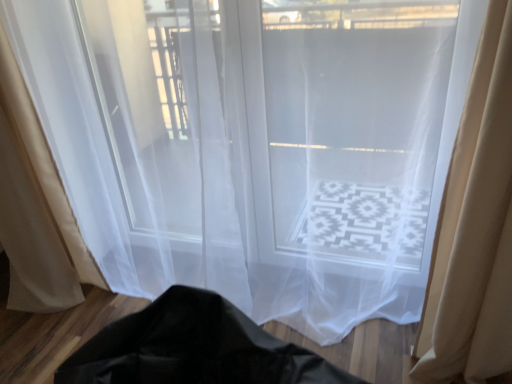
You are a GUI agent. You are given a task and a screenshot of the screen. Output one action in this format:
    pyautogui.click(x=<x>, y=<y>)
    Task: Click on the beige sheer curtain at right, the 2th curtain viewed from the left
    The height and width of the screenshot is (384, 512).
    Given the screenshot: What is the action you would take?
    pyautogui.click(x=475, y=227)

The width and height of the screenshot is (512, 384). What do you see at coordinates (475, 227) in the screenshot? I see `beige sheer curtain at right, the 2th curtain viewed from the left` at bounding box center [475, 227].

What do you see at coordinates (36, 207) in the screenshot? I see `beige sheer curtain at left, positioned as the second curtain in right-to-left order` at bounding box center [36, 207].

This screenshot has height=384, width=512. I want to click on beige sheer curtain at left, positioned as the second curtain in right-to-left order, so click(36, 207).

Locate an element on the screen. The image size is (512, 384). beige sheer curtain at right, the 2th curtain viewed from the left is located at coordinates (475, 227).

Which is more to the right, beige sheer curtain at left, the first curtain positioned from the left, or beige sheer curtain at right, which is counted as the first curtain, starting from the right?

beige sheer curtain at right, which is counted as the first curtain, starting from the right, is more to the right.

Is beige sheer curtain at left, the first curtain positioned from the left, in front of or behind beige sheer curtain at right, the 2th curtain viewed from the left, in the image?

beige sheer curtain at left, the first curtain positioned from the left, is behind beige sheer curtain at right, the 2th curtain viewed from the left.

Consider the image. Which is nearer, (32, 164) or (448, 237)?

Point (32, 164).

From the image's perspective, is beige sheer curtain at left, the first curtain positioned from the left, on beige sheer curtain at right, the 2th curtain viewed from the left?

Indeed, from the image's perspective, beige sheer curtain at left, the first curtain positioned from the left, is shown above beige sheer curtain at right, the 2th curtain viewed from the left.

From a real-world perspective, who is located lower, beige sheer curtain at left, positioned as the second curtain in right-to-left order, or beige sheer curtain at right, the 2th curtain viewed from the left?

beige sheer curtain at right, the 2th curtain viewed from the left, from a real-world perspective.

In the scene shown: Is beige sheer curtain at left, positioned as the second curtain in right-to-left order, thinner than beige sheer curtain at right, which is counted as the first curtain, starting from the right?

No.

Can you confirm if beige sheer curtain at left, positioned as the second curtain in right-to-left order, is taller than beige sheer curtain at right, the 2th curtain viewed from the left?

Correct, beige sheer curtain at left, positioned as the second curtain in right-to-left order, is much taller as beige sheer curtain at right, the 2th curtain viewed from the left.

Which of these two, beige sheer curtain at left, positioned as the second curtain in right-to-left order, or beige sheer curtain at right, the 2th curtain viewed from the left, is smaller?

Smaller between the two is beige sheer curtain at right, the 2th curtain viewed from the left.

Is beige sheer curtain at right, the 2th curtain viewed from the left, inside beige sheer curtain at left, positioned as the second curtain in right-to-left order?

No, beige sheer curtain at right, the 2th curtain viewed from the left, is not surrounded by beige sheer curtain at left, positioned as the second curtain in right-to-left order.

Is beige sheer curtain at left, the first curtain positioned from the left, in contact with beige sheer curtain at right, the 2th curtain viewed from the left?

No, beige sheer curtain at left, the first curtain positioned from the left, is not in contact with beige sheer curtain at right, the 2th curtain viewed from the left.

Is beige sheer curtain at right, which is counted as the first curtain, starting from the right, at the back of beige sheer curtain at left, positioned as the second curtain in right-to-left order?

beige sheer curtain at left, positioned as the second curtain in right-to-left order, does not have its back to beige sheer curtain at right, which is counted as the first curtain, starting from the right.

How much distance is there between beige sheer curtain at left, the first curtain positioned from the left, and beige sheer curtain at right, which is counted as the first curtain, starting from the right?

The distance of beige sheer curtain at left, the first curtain positioned from the left, from beige sheer curtain at right, which is counted as the first curtain, starting from the right, is 1.62 meters.

In the image, there is a beige sheer curtain at left, positioned as the second curtain in right-to-left order. Where is `curtain below it (from a real-world perspective)`? This screenshot has height=384, width=512. curtain below it (from a real-world perspective) is located at coordinates click(475, 227).

Which is more to the left, beige sheer curtain at right, the 2th curtain viewed from the left, or beige sheer curtain at left, positioned as the second curtain in right-to-left order?

From the viewer's perspective, beige sheer curtain at left, positioned as the second curtain in right-to-left order, appears more on the left side.

Relative to beige sheer curtain at left, the first curtain positioned from the left, is beige sheer curtain at right, the 2th curtain viewed from the left, in front or behind?

Clearly, beige sheer curtain at right, the 2th curtain viewed from the left, is in front of beige sheer curtain at left, the first curtain positioned from the left.

Considering the points (511, 121) and (23, 194), which point is in front, point (511, 121) or point (23, 194)?

The point (511, 121) is in front.

From the image's perspective, which is below, beige sheer curtain at right, the 2th curtain viewed from the left, or beige sheer curtain at left, the first curtain positioned from the left?

From the image's view, beige sheer curtain at right, the 2th curtain viewed from the left, is below.

In the scene shown: From a real-world perspective, is beige sheer curtain at right, which is counted as the first curtain, starting from the right, beneath beige sheer curtain at left, positioned as the second curtain in right-to-left order?

Indeed, from a real-world perspective, beige sheer curtain at right, which is counted as the first curtain, starting from the right, is positioned beneath beige sheer curtain at left, positioned as the second curtain in right-to-left order.

In the scene shown: In terms of width, does beige sheer curtain at right, the 2th curtain viewed from the left, look wider or thinner when compared to beige sheer curtain at left, the first curtain positioned from the left?

Clearly, beige sheer curtain at right, the 2th curtain viewed from the left, has less width compared to beige sheer curtain at left, the first curtain positioned from the left.

Considering the relative sizes of beige sheer curtain at right, the 2th curtain viewed from the left, and beige sheer curtain at left, positioned as the second curtain in right-to-left order, in the image provided, is beige sheer curtain at right, the 2th curtain viewed from the left, taller than beige sheer curtain at left, positioned as the second curtain in right-to-left order,?

Incorrect, the height of beige sheer curtain at right, the 2th curtain viewed from the left, is not larger of that of beige sheer curtain at left, positioned as the second curtain in right-to-left order.

Looking at the image, does beige sheer curtain at right, which is counted as the first curtain, starting from the right, seem bigger or smaller compared to beige sheer curtain at left, the first curtain positioned from the left?

In the image, beige sheer curtain at right, which is counted as the first curtain, starting from the right, appears to be smaller than beige sheer curtain at left, the first curtain positioned from the left.

Is beige sheer curtain at left, positioned as the second curtain in right-to-left order, a part of beige sheer curtain at right, which is counted as the first curtain, starting from the right?

No, beige sheer curtain at left, positioned as the second curtain in right-to-left order, is not a part of beige sheer curtain at right, which is counted as the first curtain, starting from the right.

Would you consider beige sheer curtain at right, the 2th curtain viewed from the left, to be distant from beige sheer curtain at left, positioned as the second curtain in right-to-left order?

Absolutely, beige sheer curtain at right, the 2th curtain viewed from the left, is distant from beige sheer curtain at left, positioned as the second curtain in right-to-left order.

Is beige sheer curtain at right, which is counted as the first curtain, starting from the right, aimed at beige sheer curtain at left, the first curtain positioned from the left?

No.

Locate an element on the screen. This screenshot has height=384, width=512. curtain located underneath the beige sheer curtain at left, the first curtain positioned from the left (from a real-world perspective) is located at coordinates (475, 227).

The height and width of the screenshot is (384, 512). I want to click on curtain lying on the right of beige sheer curtain at left, the first curtain positioned from the left, so click(475, 227).

I want to click on curtain behind the beige sheer curtain at right, the 2th curtain viewed from the left, so click(x=36, y=207).